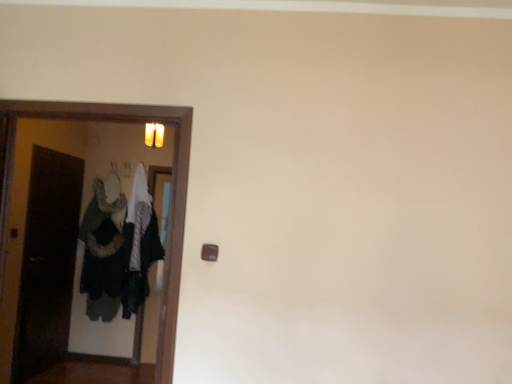
Question: Considering the relative sizes of dark gray fuzzy coat at left and wooden door at left in the image provided, is dark gray fuzzy coat at left bigger than wooden door at left?

Choices:
 (A) no
 (B) yes

Answer: (B)

Question: Is dark gray fuzzy coat at left not inside wooden door at left?

Choices:
 (A) yes
 (B) no

Answer: (A)

Question: Can you confirm if dark gray fuzzy coat at left is smaller than wooden door at left?

Choices:
 (A) yes
 (B) no

Answer: (B)

Question: Is dark gray fuzzy coat at left at the right side of wooden door at left?

Choices:
 (A) yes
 (B) no

Answer: (B)

Question: Is dark gray fuzzy coat at left next to wooden door at left?

Choices:
 (A) yes
 (B) no

Answer: (B)

Question: Is dark gray fuzzy coat at left closer to the viewer compared to wooden door at left?

Choices:
 (A) yes
 (B) no

Answer: (B)

Question: Does wooden door at left touch dark gray fuzzy coat at left?

Choices:
 (A) no
 (B) yes

Answer: (A)

Question: Considering the relative positions of wooden door at left and dark gray fuzzy coat at left in the image provided, is wooden door at left in front of dark gray fuzzy coat at left?

Choices:
 (A) yes
 (B) no

Answer: (A)

Question: Is wooden door at left aimed at dark gray fuzzy coat at left?

Choices:
 (A) yes
 (B) no

Answer: (B)

Question: Is wooden door at left positioned beyond the bounds of dark gray fuzzy coat at left?

Choices:
 (A) yes
 (B) no

Answer: (A)

Question: Considering the relative sizes of wooden door at left and dark gray fuzzy coat at left in the image provided, is wooden door at left shorter than dark gray fuzzy coat at left?

Choices:
 (A) yes
 (B) no

Answer: (A)

Question: Is wooden door at left bigger than dark gray fuzzy coat at left?

Choices:
 (A) no
 (B) yes

Answer: (A)

Question: Based on their sizes in the image, would you say dark gray fuzzy coat at left is bigger or smaller than wooden door at left?

Choices:
 (A) big
 (B) small

Answer: (A)